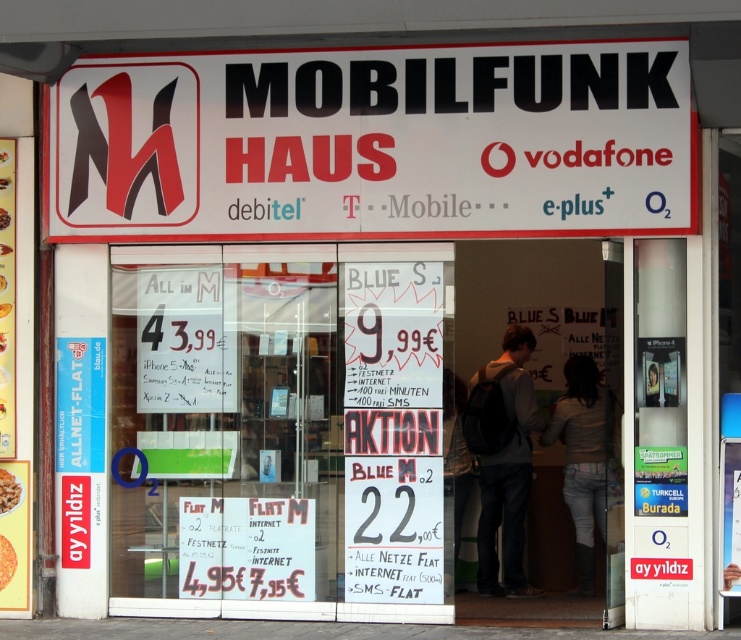
Question: Observing the image, what is the correct spatial positioning of gray cotton hoodie at center in reference to denim jacket at center?

Choices:
 (A) below
 (B) above

Answer: (B)

Question: Estimate the real-world distances between objects in this image. Which object is farther from the denim jacket at center?

Choices:
 (A) gray cotton hoodie at center
 (B) white plastic sign at upper center

Answer: (B)

Question: Which object appears closest to the camera in this image?

Choices:
 (A) white plastic sign at upper center
 (B) gray cotton hoodie at center
 (C) denim jacket at center

Answer: (A)

Question: Does white plastic sign at upper center have a greater width compared to denim jacket at center?

Choices:
 (A) no
 (B) yes

Answer: (B)

Question: Which object appears farthest from the camera in this image?

Choices:
 (A) white plastic sign at upper center
 (B) denim jacket at center
 (C) gray cotton hoodie at center

Answer: (C)

Question: Can you confirm if white plastic sign at upper center is bigger than denim jacket at center?

Choices:
 (A) yes
 (B) no

Answer: (A)